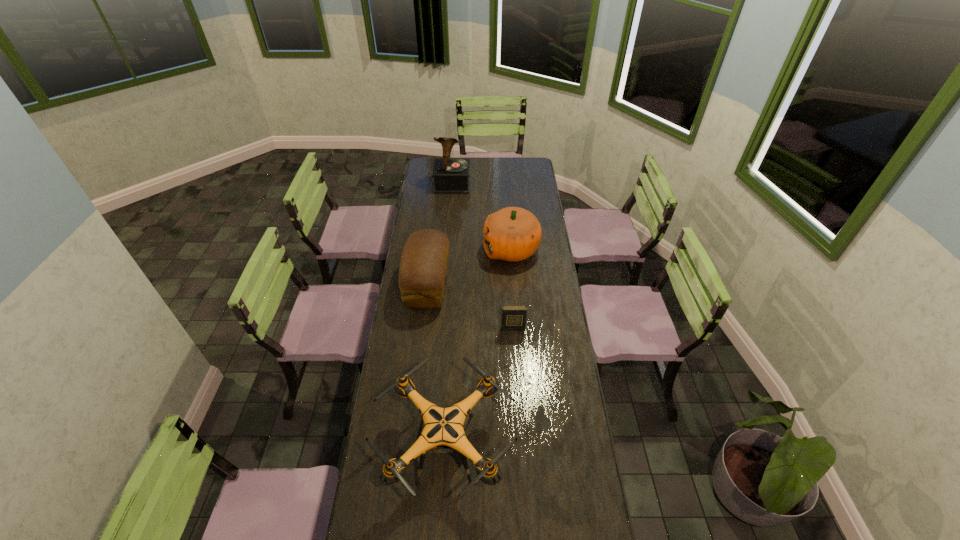
This screenshot has height=540, width=960. Identify the location of phonograph_record. (451, 176).

Find the location of a particular element. Image resolution: width=960 pixels, height=540 pixels. the farthest object is located at coordinates click(x=451, y=176).

Locate an element on the screen. The height and width of the screenshot is (540, 960). pumpkin is located at coordinates (512, 234).

This screenshot has height=540, width=960. In order to click on bread in this screenshot , I will do `click(422, 271)`.

Where is `the nearest object`? Image resolution: width=960 pixels, height=540 pixels. the nearest object is located at coordinates (443, 429).

Where is `diary`? This screenshot has height=540, width=960. diary is located at coordinates (513, 316).

Locate an element on the screen. Image resolution: width=960 pixels, height=540 pixels. the second nearest object is located at coordinates click(x=513, y=316).

Find the location of `vacant area situated at the horn opening of the phonograph_record`. vacant area situated at the horn opening of the phonograph_record is located at coordinates (450, 211).

You are a GUI agent. You are given a task and a screenshot of the screen. Output one action in this format:
    pyautogui.click(x=<x>, y=<y>)
    Task: Click on the vacant space located 0.160m on the face of the pumpkin
    
    Given the screenshot: What is the action you would take?
    pyautogui.click(x=451, y=250)

The image size is (960, 540). I want to click on free region located on the face of the pumpkin, so click(x=473, y=250).